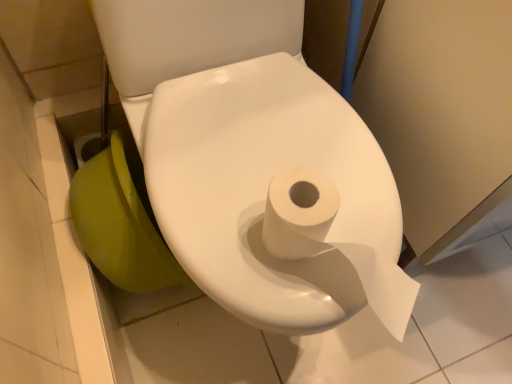
Question: Is green glossy toilet bowl at lower left in front of or behind white matte toilet paper at center in the image?

Choices:
 (A) behind
 (B) front

Answer: (A)

Question: Is green glossy toilet bowl at lower left to the left or to the right of white matte toilet paper at center in the image?

Choices:
 (A) right
 (B) left

Answer: (B)

Question: From their relative heights in the image, would you say green glossy toilet bowl at lower left is taller or shorter than white matte toilet paper at center?

Choices:
 (A) short
 (B) tall

Answer: (A)

Question: From their relative heights in the image, would you say white matte toilet paper at center is taller or shorter than green glossy toilet bowl at lower left?

Choices:
 (A) short
 (B) tall

Answer: (B)

Question: Does point (204, 198) appear closer or farther from the camera than point (117, 253)?

Choices:
 (A) closer
 (B) farther

Answer: (A)

Question: From a real-world perspective, relative to green glossy toilet bowl at lower left, is white matte toilet paper at center vertically above or below?

Choices:
 (A) above
 (B) below

Answer: (A)

Question: Is white matte toilet paper at center inside the boundaries of green glossy toilet bowl at lower left, or outside?

Choices:
 (A) outside
 (B) inside

Answer: (A)